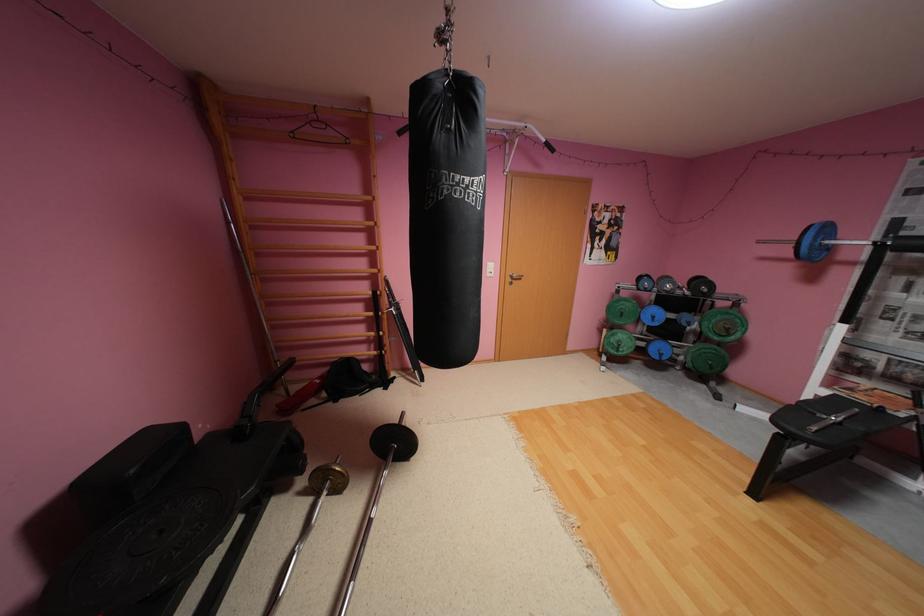
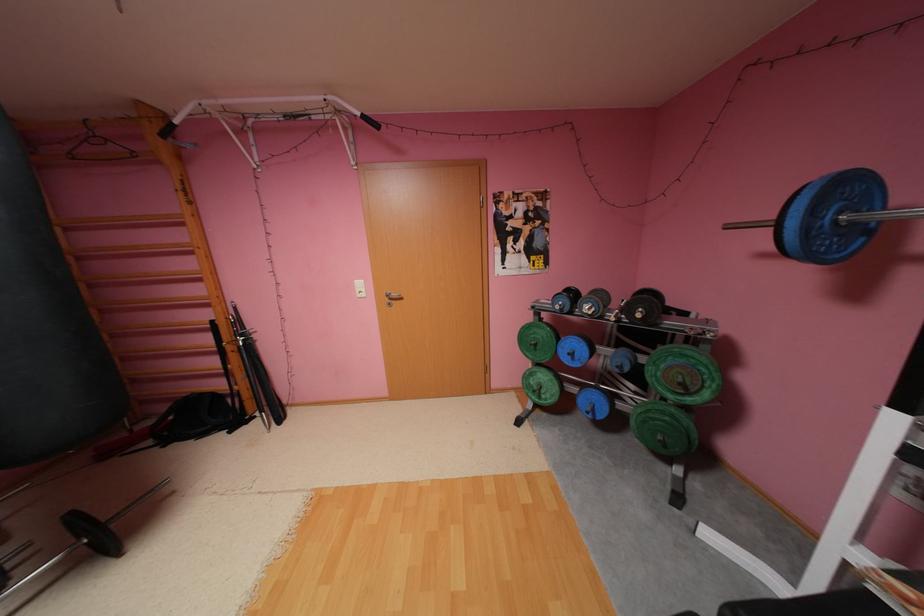
The point at (662, 317) is marked in the first image. Where is the corresponding point in the second image?

(580, 354)